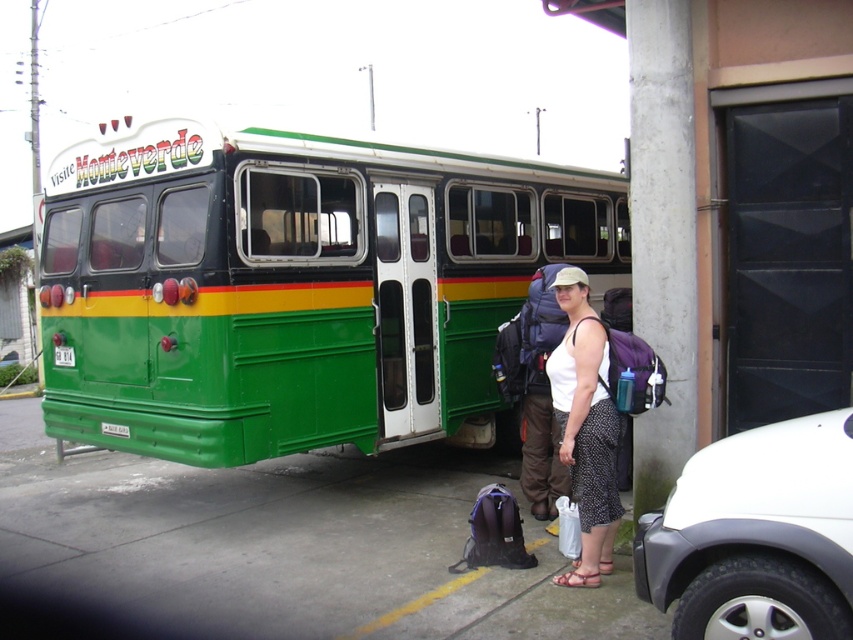
You are a pedestrian standing on the sidewalk in front of the green matte bus at center. You want to walk to the white fabric tank top at center. Which direction should you move to reach it?

The white fabric tank top at center is closer to you than the green matte bus at center. To reach the white fabric tank top at center, you should move forward towards it since it is in front of the bus.

You are a delivery person needing to place a 10 feet long package between the green matte bus at center and the white fabric tank top at center. Is there enough space between them to fit the package?

The distance between the green matte bus at center and the white fabric tank top at center is 9.28 feet, which is shorter than the 10 feet long package. Therefore, the package cannot fit between them.

You are a traveler standing next to the green matte bus at center and the white fabric tank top at center. If you want to take a photo of both objects together, which one should you position closer to the camera to ensure both fit in the frame?

Since the green matte bus at center is wider than the white fabric tank top at center, you should position the white fabric tank top at center closer to the camera to ensure both fit in the frame.